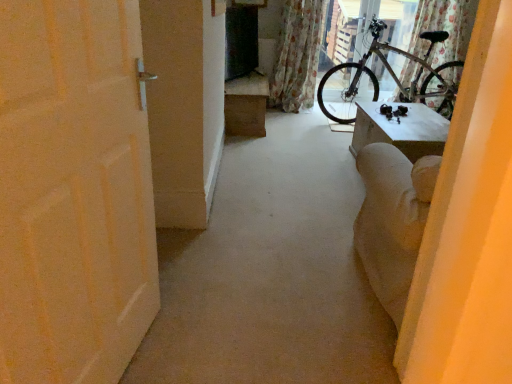
In the scene shown: Measure the distance between silver metallic bicycle at upper right and camera.

silver metallic bicycle at upper right and camera are 3.92 meters apart from each other.

Measure the distance between white matte door at left and camera.

white matte door at left is 30.25 inches from camera.

The image size is (512, 384). What are the coordinates of `brown cardboard box at center` in the screenshot? It's located at (246, 105).

From a real-world perspective, who is located lower, brown cardboard box at center or white matte door at left?

→ From a 3D spatial view, brown cardboard box at center is below.

Is brown cardboard box at center facing towards white matte door at left?

No.

Is brown cardboard box at center located outside white matte door at left?

Yes.

Does brown cardboard box at center have a greater height compared to white matte door at left?

No.

Which of these two, floral fabric curtain at upper right, which is counted as the 2th curtain, starting from the right, or white matte door at left, is wider?

With larger width is white matte door at left.

Is the surface of floral fabric curtain at upper right, which is counted as the 2th curtain, starting from the right, in direct contact with white matte door at left?

No, floral fabric curtain at upper right, which is counted as the 2th curtain, starting from the right, is not touching white matte door at left.

From the picture: Does floral fabric curtain at upper right, the 1th curtain viewed from the left, have a smaller size compared to white matte door at left?

Indeed, floral fabric curtain at upper right, the 1th curtain viewed from the left, has a smaller size compared to white matte door at left.

At what (x,y) coordinates should I click in order to perform the action: click on alley in front of the floral fabric curtain at upper right, which is counted as the 2th curtain, starting from the right. Please return your answer as a coordinate pair (x, y). This screenshot has height=384, width=512. Looking at the image, I should click on (271, 273).

How far apart are floral fabric curtain at upper right, which is the second curtain in left-to-right order, and brown cardboard box at center?

The distance of floral fabric curtain at upper right, which is the second curtain in left-to-right order, from brown cardboard box at center is 1.74 meters.

Is floral fabric curtain at upper right, which is the second curtain in left-to-right order, aimed at brown cardboard box at center?

No, floral fabric curtain at upper right, which is the second curtain in left-to-right order, does not turn towards brown cardboard box at center.

How different are the orientations of floral fabric curtain at upper right, which is the second curtain in left-to-right order, and brown cardboard box at center in degrees?

91.3 degrees separate the facing orientations of floral fabric curtain at upper right, which is the second curtain in left-to-right order, and brown cardboard box at center.

Is floral fabric curtain at upper right, which is counted as the 1th curtain, starting from the right, not near brown cardboard box at center?

floral fabric curtain at upper right, which is counted as the 1th curtain, starting from the right, is positioned a significant distance from brown cardboard box at center.

Considering their positions, is white matte door at left located in front of or behind brown cardboard box at center?

Result: white matte door at left is positioned closer to the viewer than brown cardboard box at center.

Identify the location of door in front of the brown cardboard box at center. The image size is (512, 384). (73, 192).

Is white matte door at left with brown cardboard box at center?

No, white matte door at left is not touching brown cardboard box at center.

Do you think white matte door at left is within floral fabric curtain at upper right, which is the second curtain in left-to-right order, or outside of it?

The correct answer is: outside.

Considering the relative positions of white matte door at left and floral fabric curtain at upper right, which is counted as the 1th curtain, starting from the right, in the image provided, is white matte door at left to the right of floral fabric curtain at upper right, which is counted as the 1th curtain, starting from the right, from the viewer's perspective?

Incorrect, white matte door at left is not on the right side of floral fabric curtain at upper right, which is counted as the 1th curtain, starting from the right.

Is white matte door at left thinner than floral fabric curtain at upper right, which is counted as the 1th curtain, starting from the right?

Yes.

Is the surface of white matte door at left in direct contact with floral fabric curtain at upper right, which is the second curtain in left-to-right order?

white matte door at left and floral fabric curtain at upper right, which is the second curtain in left-to-right order, are clearly separated.

Is silver metallic bicycle at upper right at the left side of brown cardboard box at center?

Incorrect, silver metallic bicycle at upper right is not on the left side of brown cardboard box at center.

Considering the relative positions of silver metallic bicycle at upper right and brown cardboard box at center in the image provided, is silver metallic bicycle at upper right behind brown cardboard box at center?

No, it is in front of brown cardboard box at center.

I want to click on bicycle in front of the brown cardboard box at center, so click(396, 76).

Considering the relative sizes of silver metallic bicycle at upper right and brown cardboard box at center in the image provided, is silver metallic bicycle at upper right bigger than brown cardboard box at center?

Correct, silver metallic bicycle at upper right is larger in size than brown cardboard box at center.

How different are the orientations of silver metallic bicycle at upper right and floral fabric curtain at upper right, the 1th curtain viewed from the left, in degrees?

The angle between the facing direction of silver metallic bicycle at upper right and the facing direction of floral fabric curtain at upper right, the 1th curtain viewed from the left, is 89.9 degrees.

In terms of size, does silver metallic bicycle at upper right appear bigger or smaller than floral fabric curtain at upper right, which is counted as the 2th curtain, starting from the right?

Clearly, silver metallic bicycle at upper right is larger in size than floral fabric curtain at upper right, which is counted as the 2th curtain, starting from the right.

Is silver metallic bicycle at upper right far away from floral fabric curtain at upper right, which is counted as the 2th curtain, starting from the right?

silver metallic bicycle at upper right is actually quite close to floral fabric curtain at upper right, which is counted as the 2th curtain, starting from the right.

Does silver metallic bicycle at upper right lie in front of floral fabric curtain at upper right, the 1th curtain viewed from the left?

Yes, the depth of silver metallic bicycle at upper right is less than that of floral fabric curtain at upper right, the 1th curtain viewed from the left.

Find the location of a particular element. This screenshot has height=384, width=512. door that appears below the brown cardboard box at center (from the image's perspective) is located at coordinates (73, 192).

Locate an element on the screen. alley in front of the floral fabric curtain at upper right, which is counted as the 2th curtain, starting from the right is located at coordinates (271, 273).

Considering their positions, is brown cardboard box at center positioned further to floral fabric curtain at upper right, which is the second curtain in left-to-right order, than white matte door at left?

white matte door at left is positioned further to the anchor floral fabric curtain at upper right, which is the second curtain in left-to-right order.

Estimate the real-world distances between objects in this image. Which object is further from floral fabric curtain at upper right, which is the second curtain in left-to-right order, floral fabric curtain at upper right, the 1th curtain viewed from the left, or white matte door at left?

Based on the image, white matte door at left appears to be further to floral fabric curtain at upper right, which is the second curtain in left-to-right order.

From the image, which object appears to be farther from floral fabric curtain at upper right, which is counted as the 1th curtain, starting from the right, floral fabric curtain at upper right, the 1th curtain viewed from the left, or silver metallic bicycle at upper right?

Among the two, floral fabric curtain at upper right, the 1th curtain viewed from the left, is located further to floral fabric curtain at upper right, which is counted as the 1th curtain, starting from the right.

Consider the image. Which object lies further to the anchor point floral fabric curtain at upper right, the 1th curtain viewed from the left, brown cardboard box at center or white matte door at left?

Based on the image, white matte door at left appears to be further to floral fabric curtain at upper right, the 1th curtain viewed from the left.

Estimate the real-world distances between objects in this image. Which object is further from brown cardboard box at center, silver metallic bicycle at upper right or floral fabric curtain at upper right, the 1th curtain viewed from the left?

Based on the image, silver metallic bicycle at upper right appears to be further to brown cardboard box at center.

Considering their positions, is white matte door at left positioned closer to white matte door at left than silver metallic bicycle at upper right?

white matte door at left is closer to white matte door at left.

Which object lies further to the anchor point brown cardboard box at center, white matte door at left or white matte door at left?

white matte door at left is positioned further to the anchor brown cardboard box at center.

From the image, which object appears to be farther from floral fabric curtain at upper right, the 1th curtain viewed from the left, floral fabric curtain at upper right, which is counted as the 1th curtain, starting from the right, or white matte door at left?

white matte door at left lies further to floral fabric curtain at upper right, the 1th curtain viewed from the left, than the other object.

The image size is (512, 384). Find the location of `bicycle between white matte door at left and floral fabric curtain at upper right, which is the second curtain in left-to-right order, along the z-axis`. bicycle between white matte door at left and floral fabric curtain at upper right, which is the second curtain in left-to-right order, along the z-axis is located at coordinates (396, 76).

You are a GUI agent. You are given a task and a screenshot of the screen. Output one action in this format:
    pyautogui.click(x=<x>, y=<y>)
    Task: Click on the furniture between white matte door at left and floral fabric curtain at upper right, which is counted as the 2th curtain, starting from the right, from front to back
    
    Given the screenshot: What is the action you would take?
    pyautogui.click(x=246, y=105)

Find the location of a particular element. alley positioned between white matte door at left and floral fabric curtain at upper right, which is the second curtain in left-to-right order, from near to far is located at coordinates (271, 273).

Image resolution: width=512 pixels, height=384 pixels. Identify the location of bicycle located between white matte door at left and brown cardboard box at center in the depth direction. (396, 76).